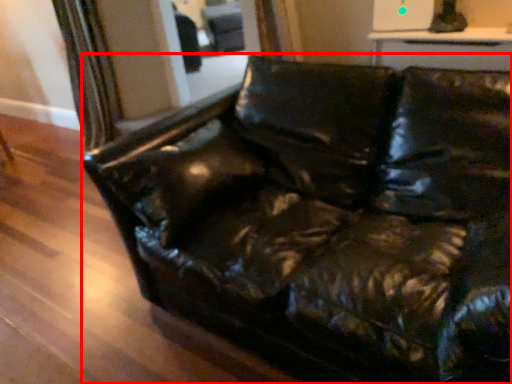
Question: Considering the relative positions of studio couch (annotated by the red box) and swivel chair in the image provided, where is studio couch (annotated by the red box) located with respect to the staircase?

Choices:
 (A) right
 (B) left

Answer: (A)